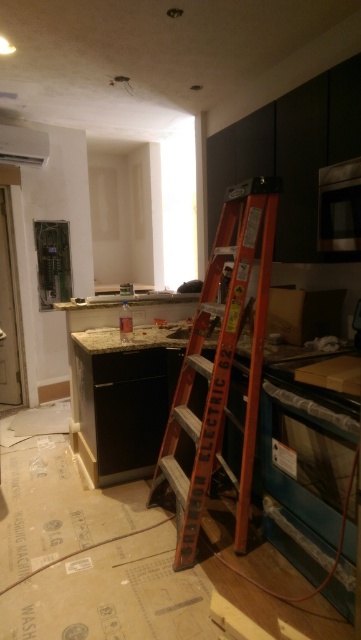
You are standing in the kitchen and want to reach the point at coordinates [218,365]. The red ladder leaning against the counter is 8 feet long. Can you use the ladder to safely reach that point?

The point at coordinates [218,365] is 7.52 feet from the camera, and the ladder is 8 feet long. Since the ladder is longer than the distance to the point, it can be used to safely reach it.

You are a contractor working in this kitchen and need to move the orange wooden ladder at center and the white plastic exhaust hood at upper left. Based on their sizes, which one would require more space to move around?

The orange wooden ladder at center is larger in size than the white plastic exhaust hood at upper left, so it would require more space to move around.

You are standing in the kitchen and see the point at coordinates (219, 369). Which object is this point located on?

The point at coordinates (219, 369) is located on the orange wooden ladder at center.